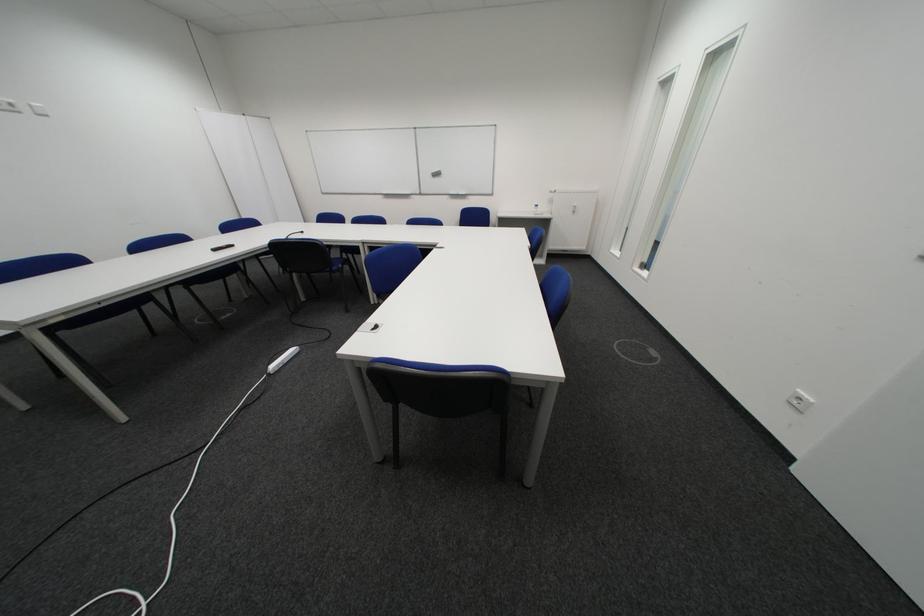
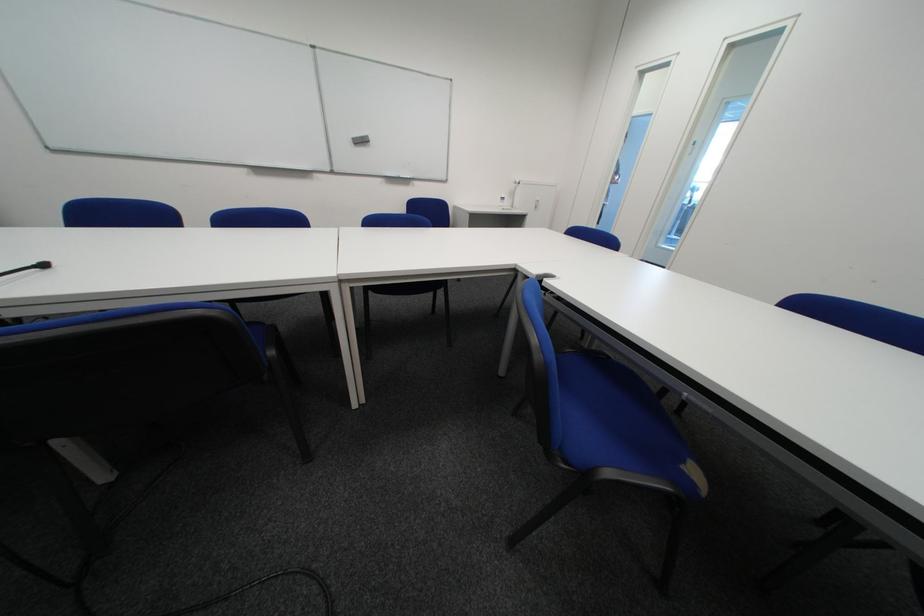
Find the pixel in the second image that matches pixel 546 213 in the first image.

(513, 207)